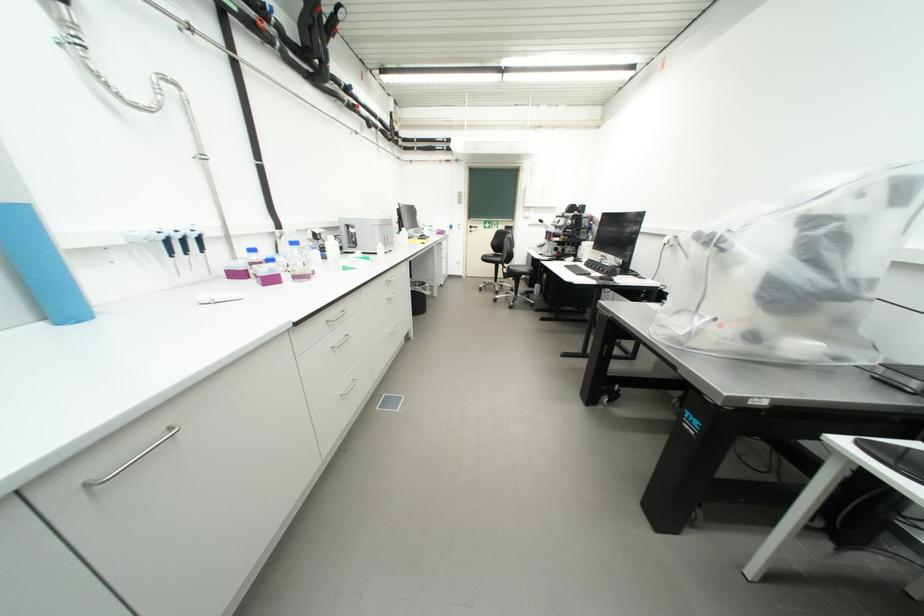
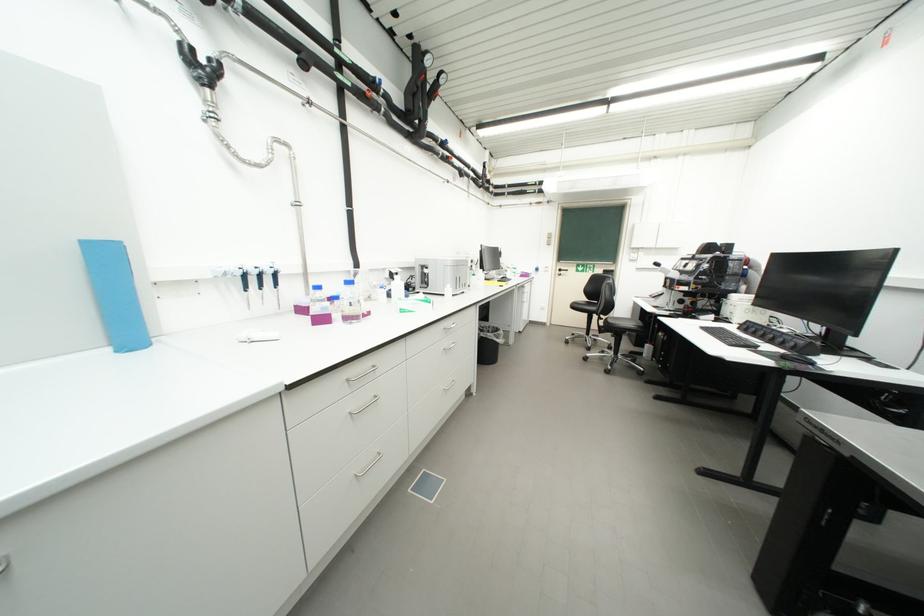
Locate, in the second image, the point that corresponds to the point at 269,265 in the first image.

(330, 302)